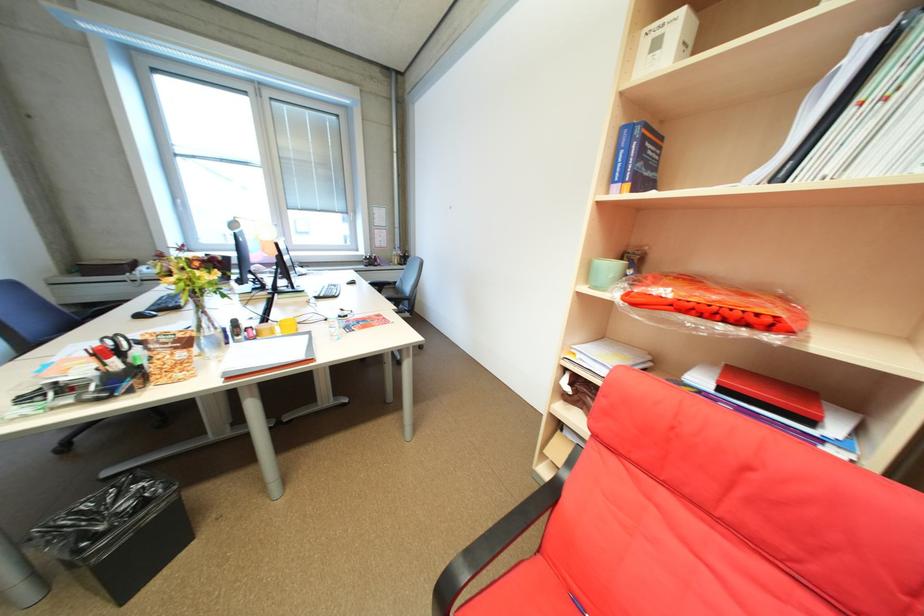
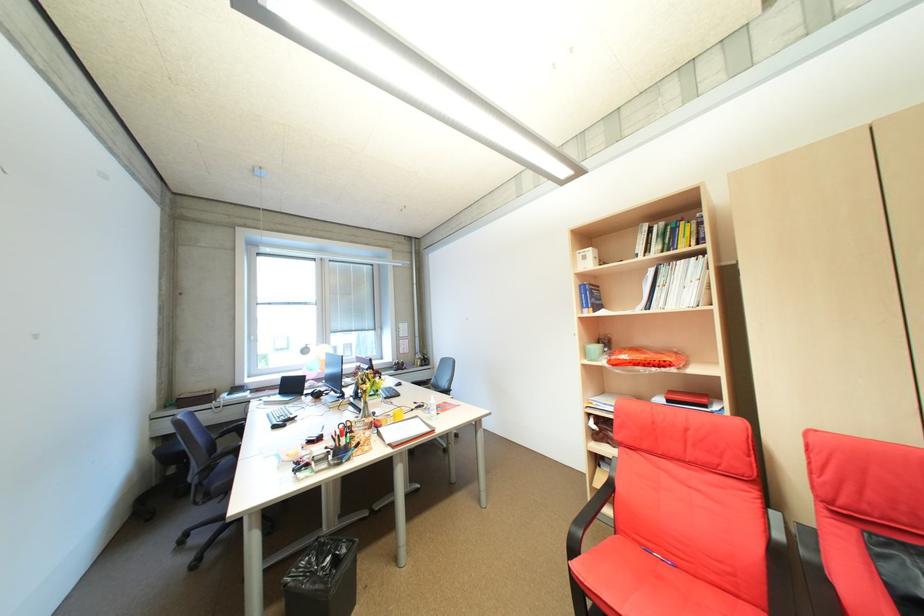
The point at (651, 140) is marked in the first image. Where is the corresponding point in the second image?

(600, 291)